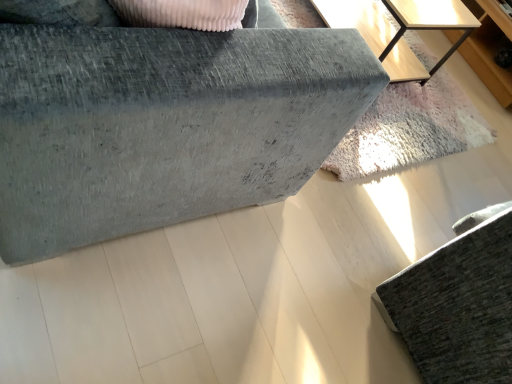
Question: Does point (500, 334) appear closer or farther from the camera than point (434, 16)?

Choices:
 (A) farther
 (B) closer

Answer: (B)

Question: From a real-world perspective, is textured gray sofa at lower right, the 1th furniture positioned from the right, positioned above or below light wood table at upper right?

Choices:
 (A) above
 (B) below

Answer: (A)

Question: Considering the real-world distances, which object is closest to the textured gray sofa at lower right, the 1th furniture positioned from the right?

Choices:
 (A) light wood dresser at upper right
 (B) velvet grey sofa at upper left, the 2th furniture viewed from the right
 (C) light wood table at upper right

Answer: (B)

Question: Which object is positioned closest to the velvet grey sofa at upper left, the 2th furniture viewed from the right?

Choices:
 (A) textured gray sofa at lower right, acting as the 2th furniture starting from the left
 (B) light wood dresser at upper right
 (C) light wood table at upper right

Answer: (A)